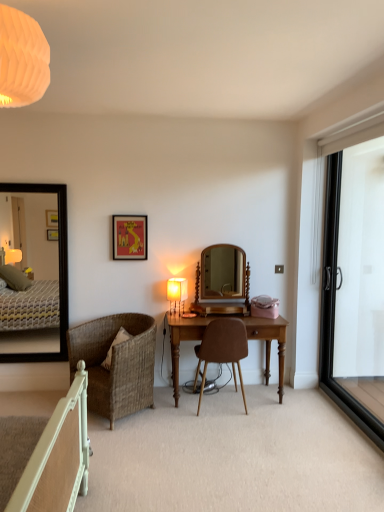
You are a GUI agent. You are given a task and a screenshot of the screen. Output one action in this format:
    pyautogui.click(x=<x>, y=<y>)
    Task: Click on the vacant space in front of matte yellow lampshade at center, the 1th lamp positioned from the back
    The width and height of the screenshot is (384, 512).
    Given the screenshot: What is the action you would take?
    pyautogui.click(x=185, y=314)